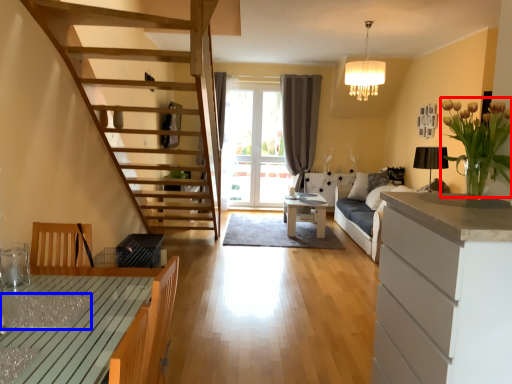
Question: Which object is closer to the camera taking this photo, flower (highlighted by a red box) or glass table (highlighted by a blue box)?

Choices:
 (A) flower
 (B) glass table

Answer: (B)